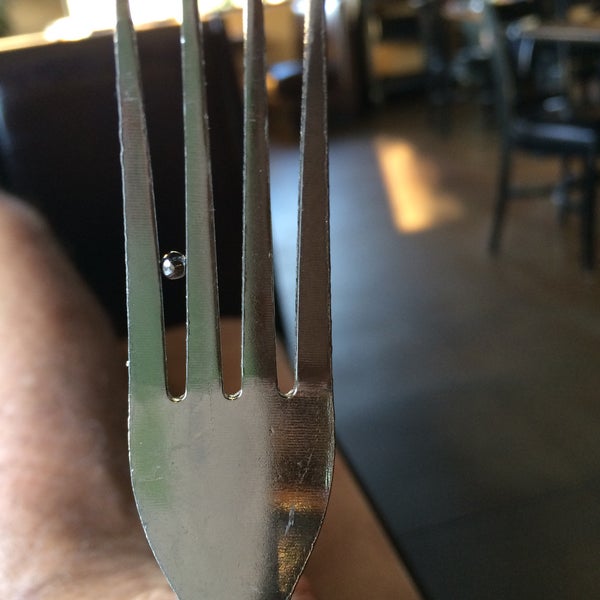
Where is `booth`? The image size is (600, 600). booth is located at coordinates (408, 53).